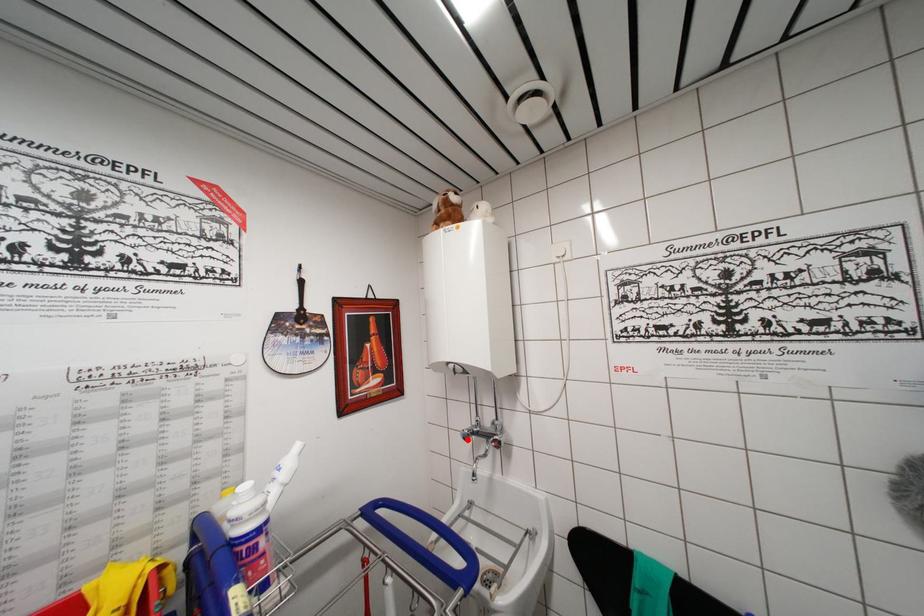
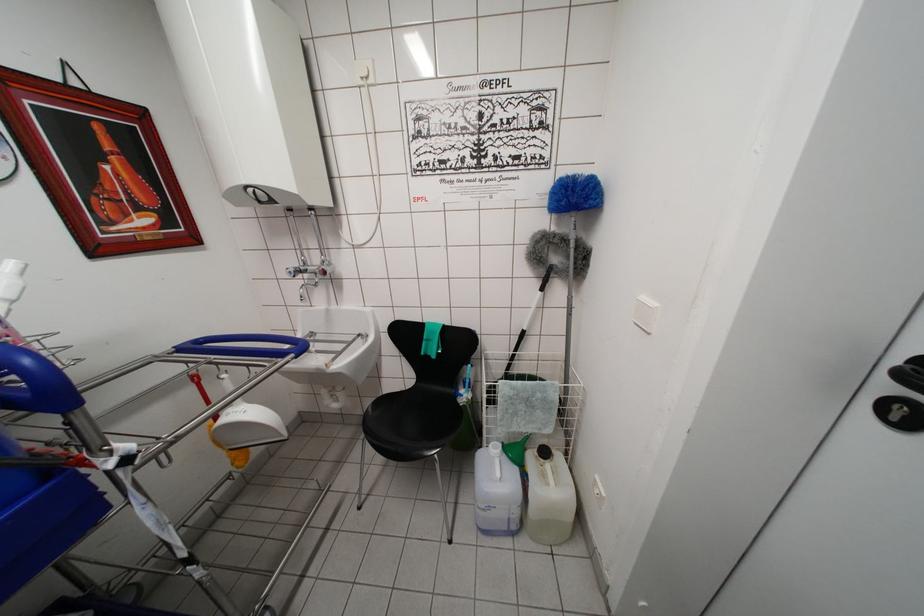
Locate, in the second image, the point that corresponds to the highlighted location in the first image.

(293, 277)